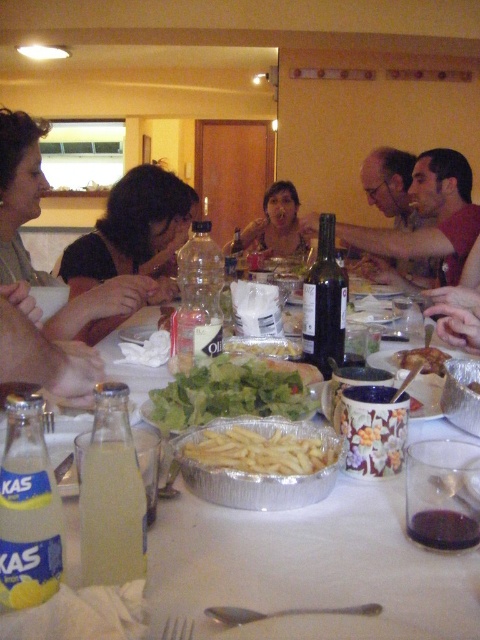
You are a customer in the restaurant looking at the table. Which object is positioned lower on the table between the matte black shirt at upper left and the matte skin at center?

The matte black shirt at upper left is positioned lower on the table than the matte skin at center.

You are a server at the restaurant and need to place a new menu on the table. The menu is the same width as the clear glass bottle at lower left. Can you fit it next to the silver aluminum tray at center without overlapping?

The silver aluminum tray at center is wider than the clear glass bottle at lower left. Since the menu has the same width as the bottle, it should fit next to the tray as there is space available.

You are standing in the dining room and want to place a small vase on the table. The table is located in the center of the room. Where should you place the vase so that it is as close as possible to the matte black shirt at upper left without overlapping any other objects?

The vase should be placed near the upper left corner of the table, close to the position of the matte black shirt at upper left at point [20,193], ensuring it doesn not overlap with other items on the table.